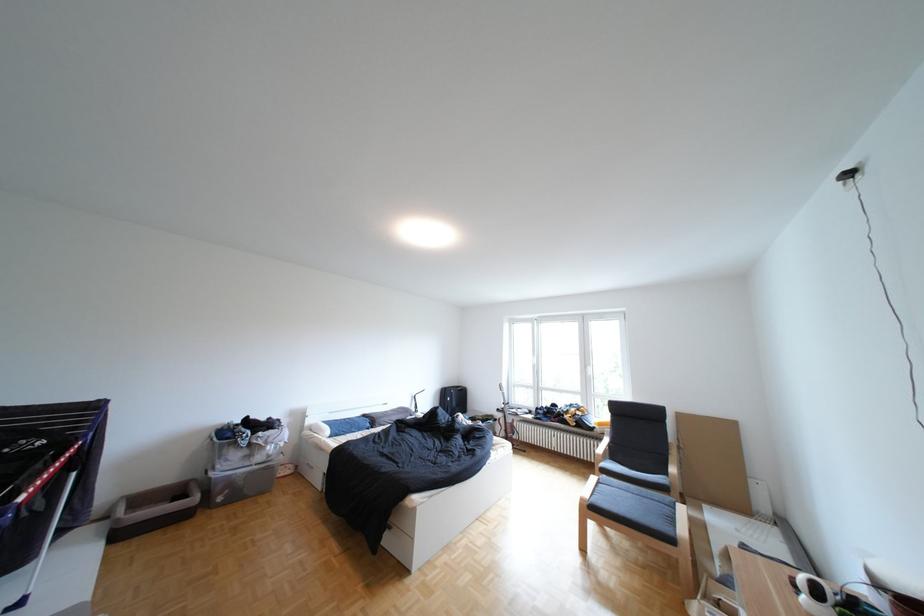
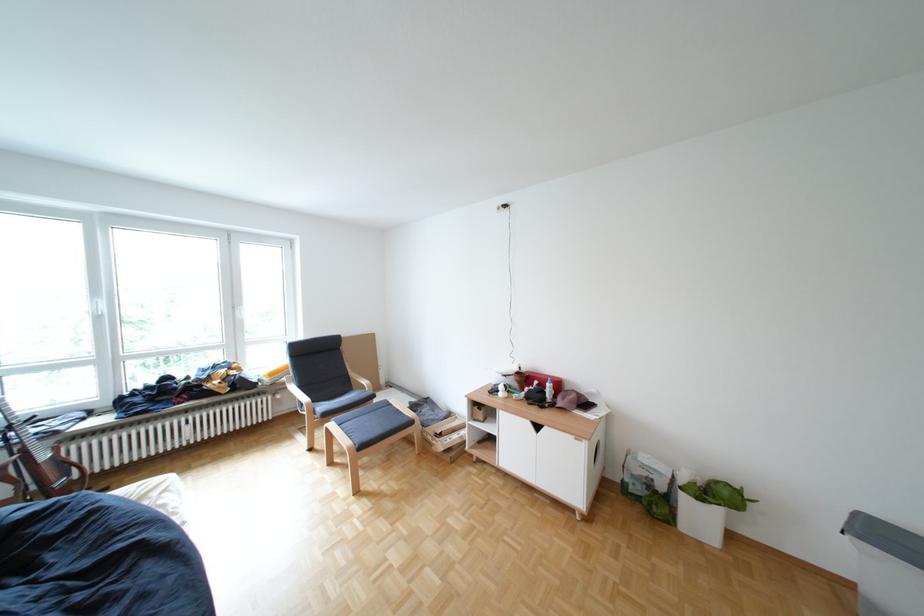
Where in the second image is the point corresponding to (x=615, y=424) from the first image?

(286, 374)